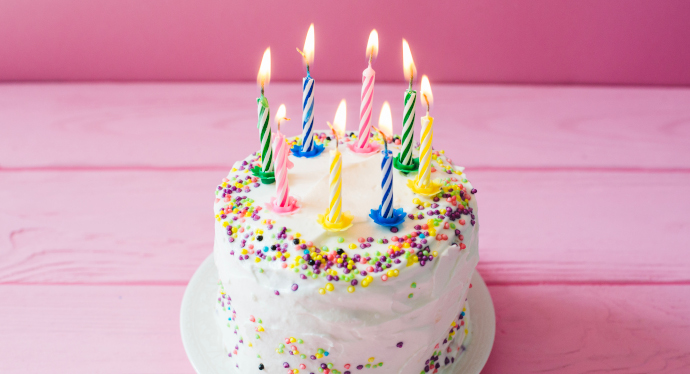
The image size is (690, 374). I want to click on candles, so click(x=426, y=125), click(x=412, y=114), click(x=368, y=94), click(x=386, y=177), click(x=334, y=173), click(x=315, y=112), click(x=266, y=122), click(x=281, y=151).